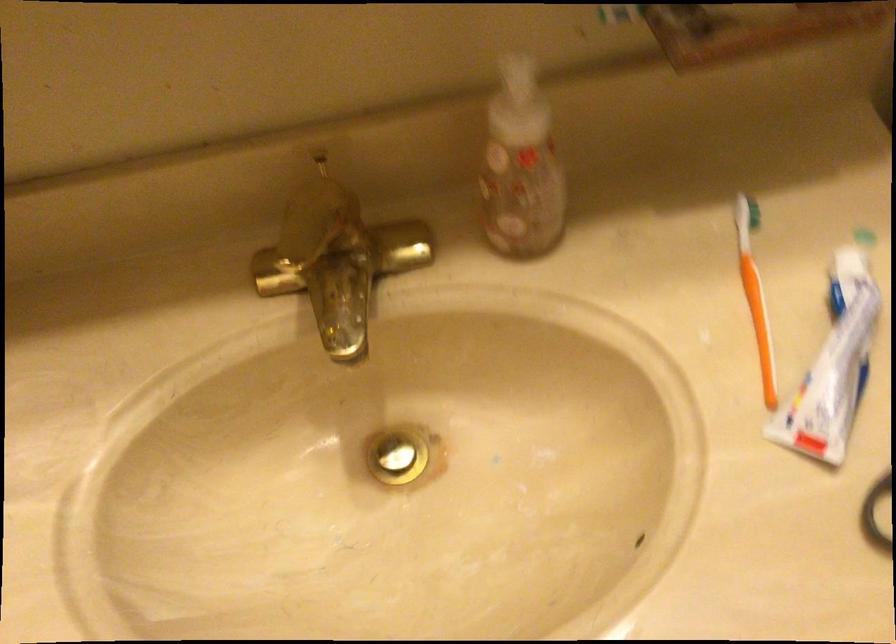
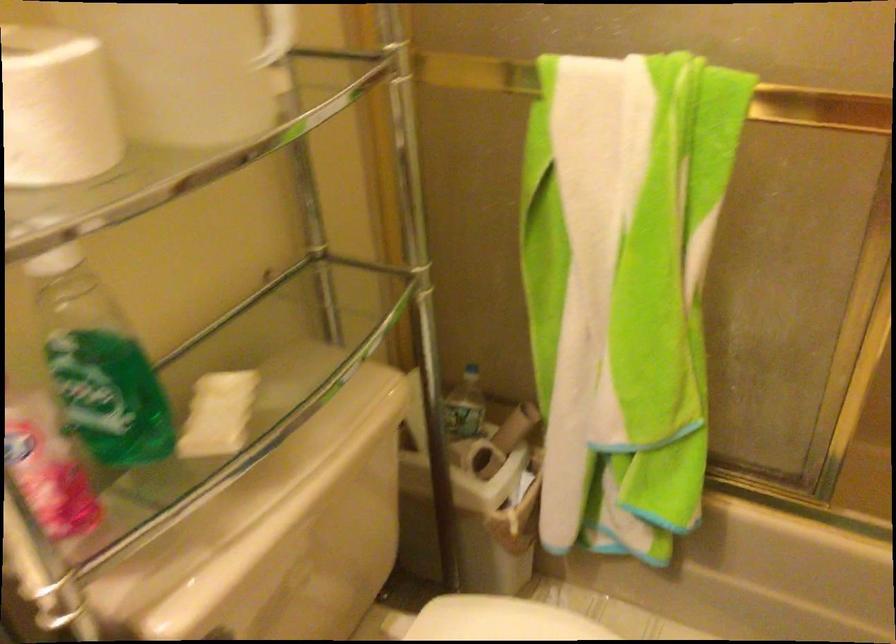
Question: How did the camera likely rotate?

Choices:
 (A) Left
 (B) Right
 (C) Up
 (D) Down

Answer: (B)